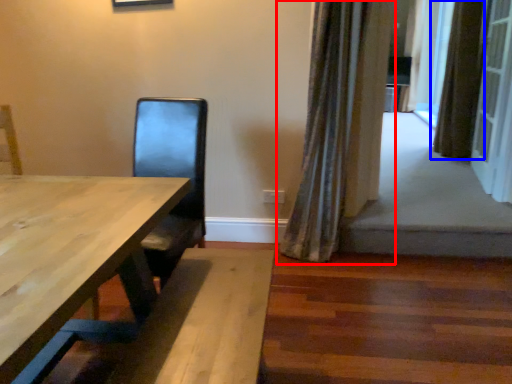
Question: Which point is further to the camera, curtain (highlighted by a red box) or curtain (highlighted by a blue box)?

Choices:
 (A) curtain
 (B) curtain

Answer: (B)